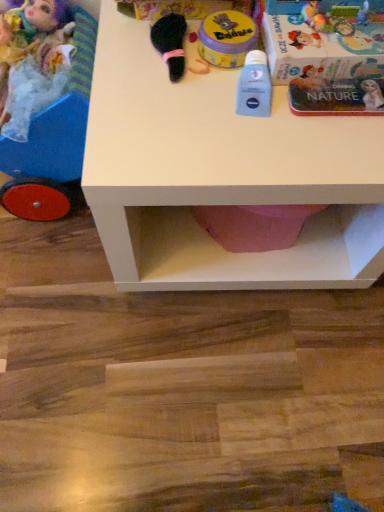
Identify the location of free space in front of yellow matte container at upper center, acting as the 2th toy starting from the right. (219, 132).